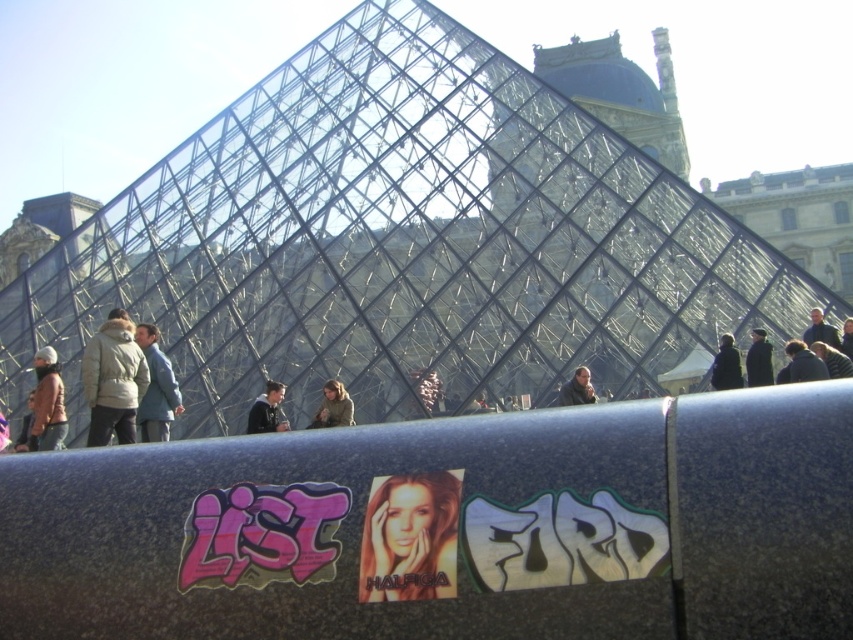
From the picture: Between matte black jacket at center and light brown leather jacket at lower left, which one is positioned higher?

Positioned higher is matte black jacket at center.

The height and width of the screenshot is (640, 853). Find the location of `matte black jacket at center`. matte black jacket at center is located at coordinates (577, 388).

This screenshot has width=853, height=640. Identify the location of matte black jacket at center. (577, 388).

Which is in front, point (15, 449) or point (849, 340)?

Point (849, 340) is in front.

Between light brown leather jacket at lower left and dark blue jacket at upper right, which one has less height?

Standing shorter between the two is dark blue jacket at upper right.

You are a GUI agent. You are given a task and a screenshot of the screen. Output one action in this format:
    pyautogui.click(x=<x>, y=<y>)
    Task: Click on the light brown leather jacket at lower left
    The image size is (853, 640).
    Given the screenshot: What is the action you would take?
    pyautogui.click(x=26, y=428)

Between dark blue jacket at right and black fabric jacket at center, which one has less height?

With less height is dark blue jacket at right.

Looking at this image, does dark blue jacket at right have a greater width compared to black fabric jacket at center?

Incorrect, dark blue jacket at right's width does not surpass black fabric jacket at center's.

The image size is (853, 640). I want to click on dark blue jacket at right, so click(x=801, y=364).